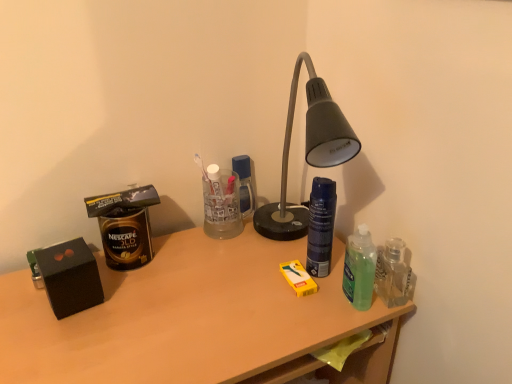
Find the location of a particular element. The height and width of the screenshot is (384, 512). free location in front of shiny dark blue spray can at center-right is located at coordinates (305, 317).